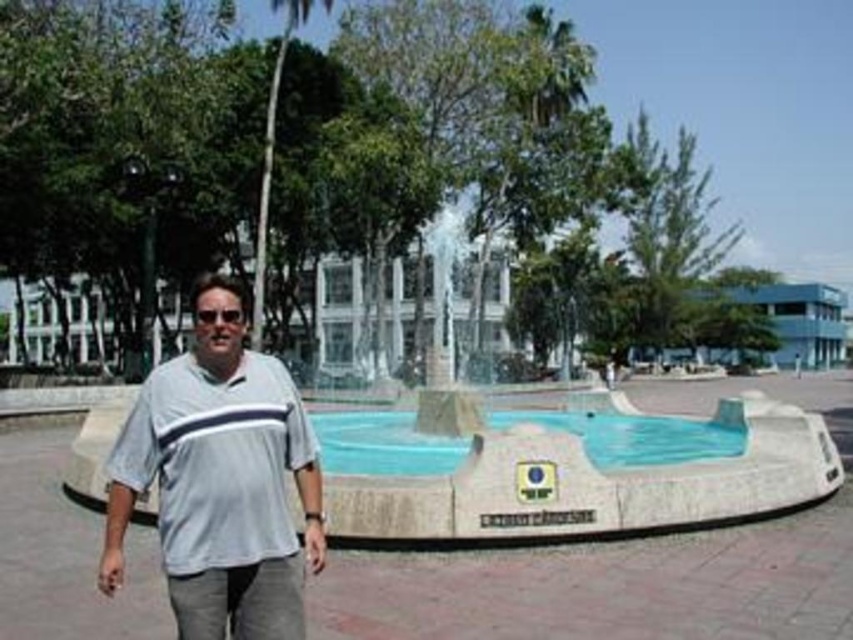
Is gray cotton shirt at center bigger than clear blue water at center?

Actually, gray cotton shirt at center might be smaller than clear blue water at center.

Does gray cotton shirt at center appear on the right side of clear blue water at center?

Incorrect, gray cotton shirt at center is not on the right side of clear blue water at center.

The image size is (853, 640). Find the location of `gray cotton shirt at center`. gray cotton shirt at center is located at coordinates (219, 481).

Find the location of a particular element. white stone fountain at center is located at coordinates (469, 461).

Between white stone fountain at center and green leafy palm tree at upper center, which one appears on the left side from the viewer's perspective?

From the viewer's perspective, green leafy palm tree at upper center appears more on the left side.

Is point (393, 484) more distant than point (260, 243)?

No, (393, 484) is closer to viewer.

I want to click on white stone fountain at center, so click(x=469, y=461).

Does point (433, 460) lie in front of point (351, 445)?

That is True.

Does point (370, 417) come behind point (329, 417)?

Yes.

The image size is (853, 640). Find the location of `white stone fountain at center`. white stone fountain at center is located at coordinates [x=469, y=461].